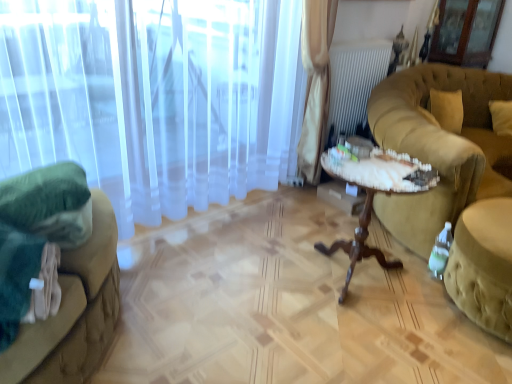
Question: From a real-world perspective, is transparent glass screen door at upper right physically located above or below green fabric ottoman at lower right?

Choices:
 (A) below
 (B) above

Answer: (B)

Question: Is point (441, 1) closer or farther from the camera than point (501, 284)?

Choices:
 (A) closer
 (B) farther

Answer: (B)

Question: Estimate the real-world distances between objects in this image. Which object is closer to the green fabric ottoman at lower right?

Choices:
 (A) tufted leather couch at right, the first studio couch from the right
 (B) white sheer curtain at left
 (C) transparent glass screen door at upper right
 (D) green fabric studio couch at left, positioned as the first studio couch in left-to-right order
 (E) woodenwoodentable at right

Answer: (E)

Question: Which of these objects is positioned closest to the white sheer curtain at left?

Choices:
 (A) green fabric studio couch at left, acting as the 2th studio couch starting from the right
 (B) transparent glass screen door at upper right
 (C) tufted leather couch at right, placed as the 2th studio couch when sorted from left to right
 (D) woodenwoodentable at right
 (E) green fabric ottoman at lower right

Answer: (A)